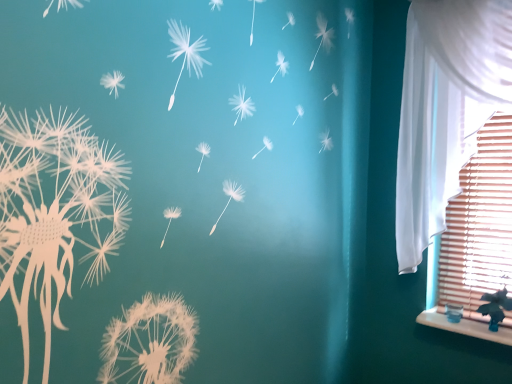
Measure the distance between point [473,310] and camera.

They are 6.70 feet apart.

Consider the image. In order to face wooden blinds at right, should I rotate leftwards or rightwards?

Rotate your view right by about 27.338°.

The image size is (512, 384). What are the coordinates of `wooden blinds at right` in the screenshot? It's located at (480, 225).

Image resolution: width=512 pixels, height=384 pixels. Describe the element at coordinates (480, 225) in the screenshot. I see `wooden blinds at right` at that location.

Locate an element on the screen. The image size is (512, 384). wooden blinds at right is located at coordinates (480, 225).